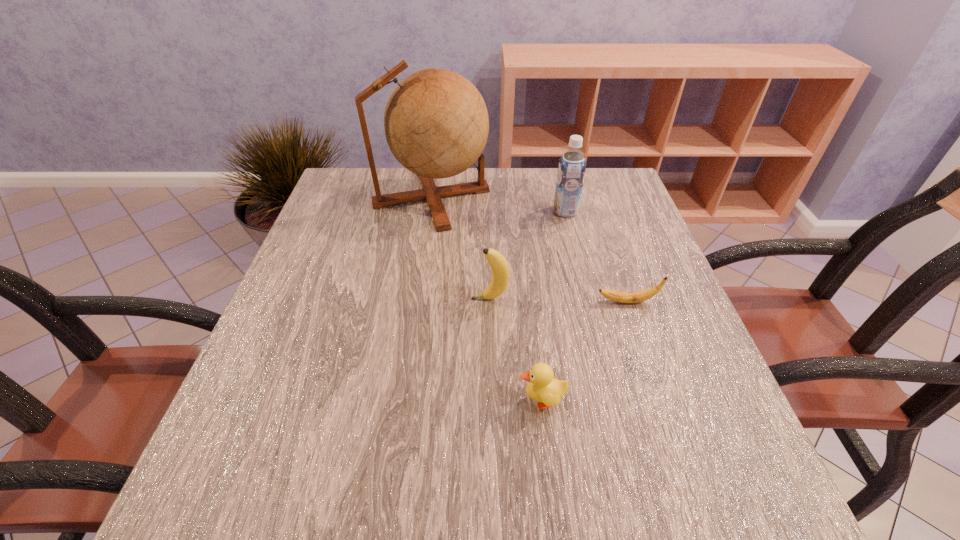
You are a GUI agent. You are given a task and a screenshot of the screen. Output one action in this format:
    pyautogui.click(x=<x>, y=<y>)
    Task: Click on the free area in between the duckling and the taller banana
    This screenshot has width=960, height=540.
    Given the screenshot: What is the action you would take?
    pyautogui.click(x=516, y=349)

Locate an element on the screen. The width and height of the screenshot is (960, 540). unoccupied area between the left banana and the globe is located at coordinates (461, 248).

Locate an element on the screen. The width and height of the screenshot is (960, 540). vacant space that's between the nearest object and the third shortest object is located at coordinates (516, 349).

Choose which object is the second nearest neighbor to the third object from right to left. Please provide its 2D coordinates. Your answer should be formatted as a tuple, i.e. [(x, y)], where the tuple contains the x and y coordinates of a point satisfying the conditions above.

[(618, 296)]

Identify the location of object that ranks as the third closest to the taller banana. (436, 123).